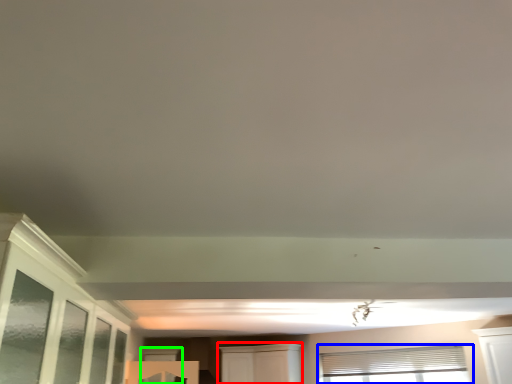
Question: Which object is positioned closest to cabinetry (highlighted by a red box)? Select from window (highlighted by a blue box) and window (highlighted by a green box).

Choices:
 (A) window
 (B) window

Answer: (A)